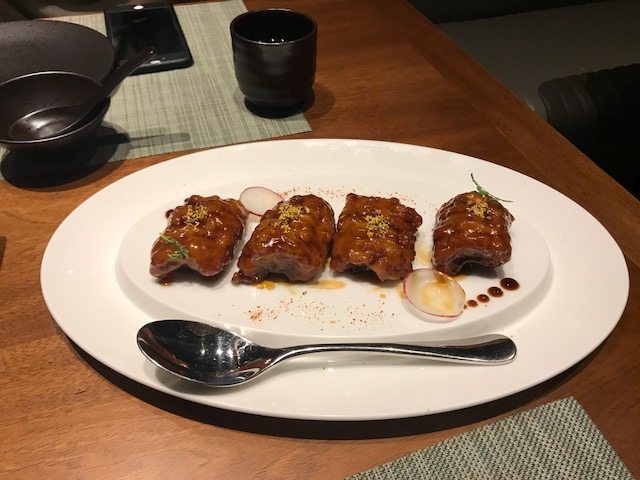
You are a GUI agent. You are given a task and a screenshot of the screen. Output one action in this format:
    pyautogui.click(x=<x>, y=<y>)
    Task: Click on the grey mat
    The height and width of the screenshot is (480, 640).
    Given the screenshot: What is the action you would take?
    pyautogui.click(x=196, y=32), pyautogui.click(x=529, y=454)